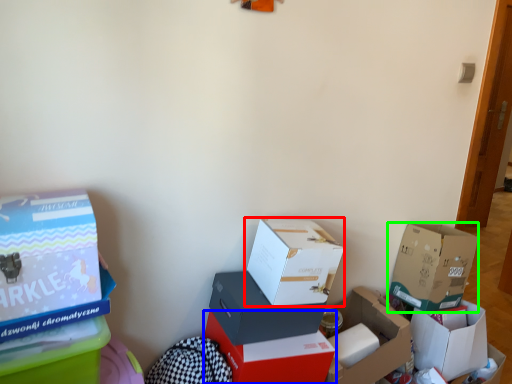
Question: Which object is the closest to the box (highlighted by a red box)? Choose among these: box (highlighted by a blue box) or box (highlighted by a green box).

Choices:
 (A) box
 (B) box

Answer: (A)